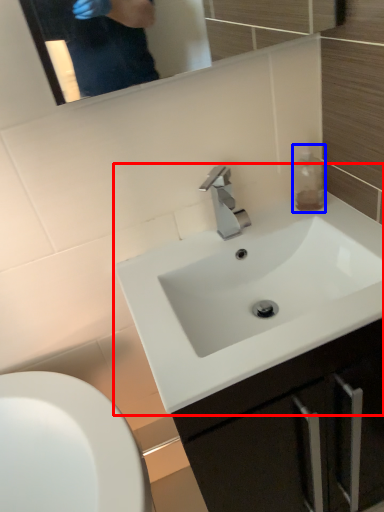
Question: Among these objects, which one is nearest to the camera, sink (highlighted by a red box) or bottle (highlighted by a blue box)?

Choices:
 (A) sink
 (B) bottle

Answer: (A)